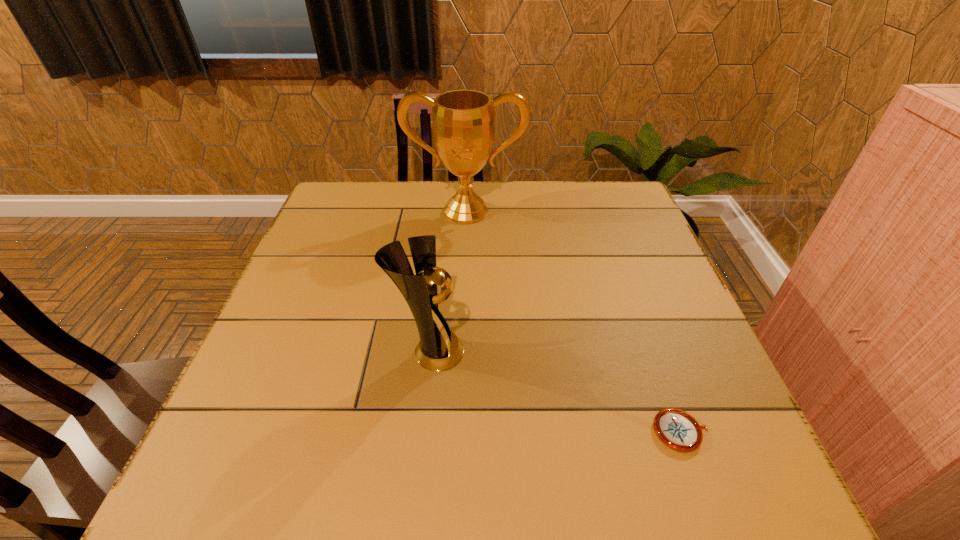
Find the location of a particular element. The height and width of the screenshot is (540, 960). the tallest object is located at coordinates (463, 120).

The height and width of the screenshot is (540, 960). In order to click on the farthest object in this screenshot , I will do `click(463, 120)`.

The height and width of the screenshot is (540, 960). I want to click on the second farthest object, so click(x=439, y=349).

This screenshot has height=540, width=960. I want to click on the shorter award, so click(x=439, y=349).

Find the location of a particular element. the nearest object is located at coordinates (677, 429).

This screenshot has width=960, height=540. I want to click on the shortest object, so click(677, 429).

Find the location of a particular element. This screenshot has height=540, width=960. vacant space located on the front-facing side of the farthest object is located at coordinates (462, 301).

Image resolution: width=960 pixels, height=540 pixels. Find the location of `free point located 0.380m at the front of the second shortest object, where the globe is visible`. free point located 0.380m at the front of the second shortest object, where the globe is visible is located at coordinates (644, 352).

Find the location of a particular element. This screenshot has width=960, height=540. vacant space located on the left of the nearest object is located at coordinates (581, 431).

This screenshot has height=540, width=960. In order to click on object that is positioned at the far edge in this screenshot , I will do `click(463, 120)`.